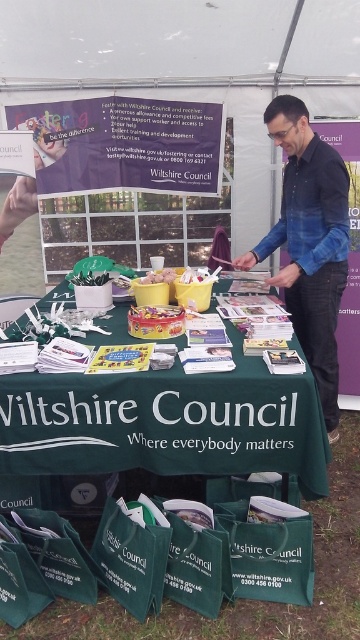
You are standing at the Wiltshire Council information table and want to pick up an item from the table. There are two points marked on the table where items are placed. The first point is at coordinates point [163,428] and the second is at point [299,241]. Which point is closer to you?

Point [163,428] is closer to the viewer than point [299,241].

You are at an outdoor event and see the green fabric table at center and the blue denim shirt at center. Which object is located more to the left?

The green fabric table at center is positioned more to the left than the blue denim shirt at center.